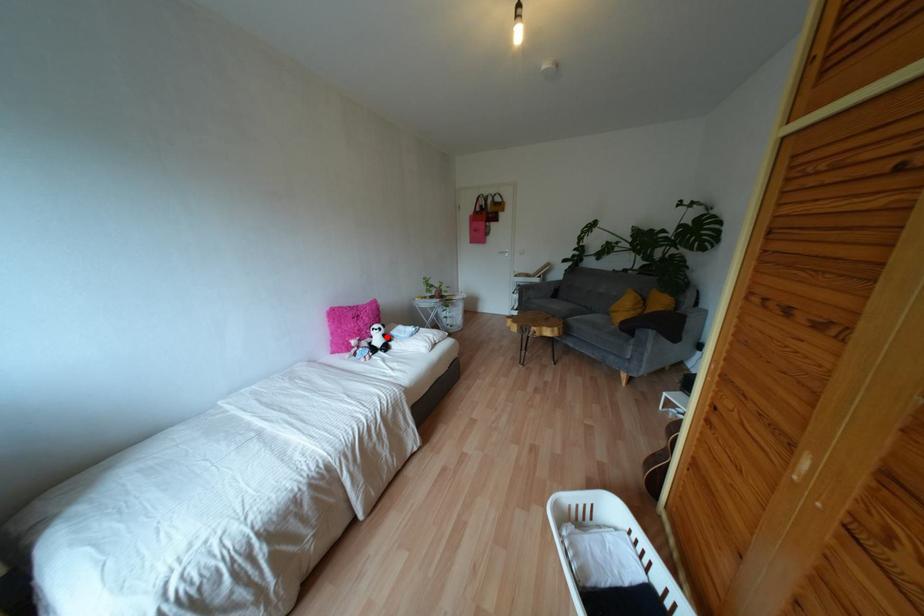
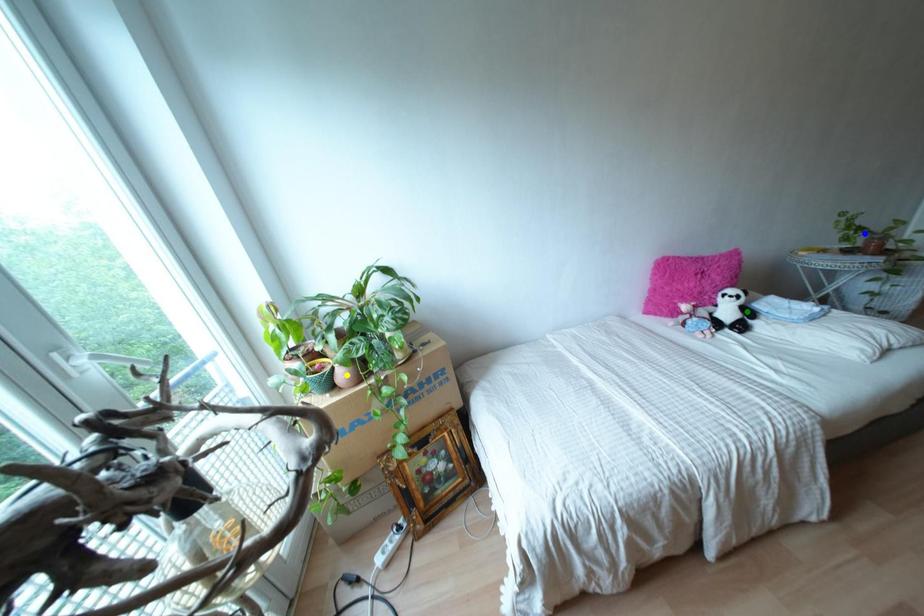
Question: I am providing you with two images of the same scene from different viewpoints. A red point is marked on the first image. You are given multiple points on the second image. Which spot in image 2 lines up with the point in image 1?

Choices:
 (A) yellow point
 (B) blue point
 (C) green point

Answer: (C)